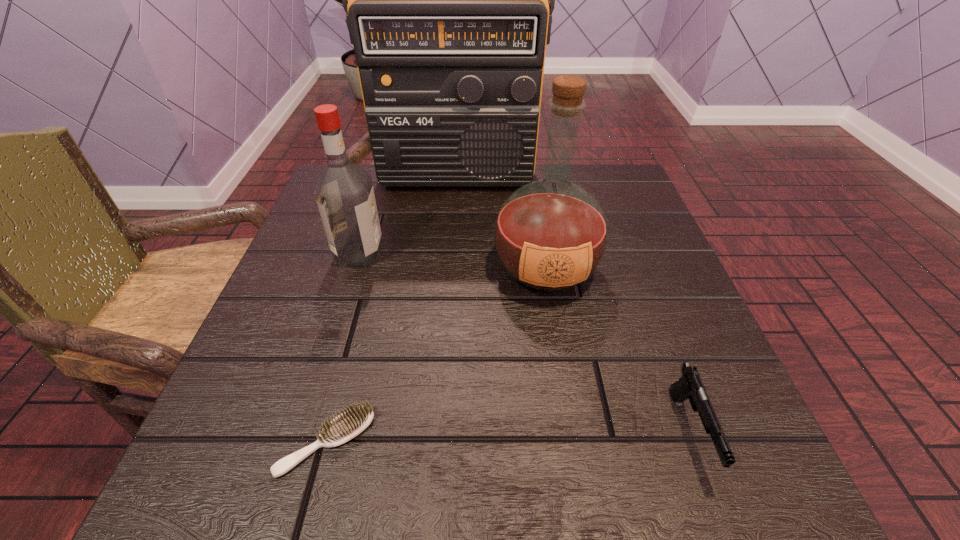
Find the location of a particular element. The image size is (960, 540). the farthest object is located at coordinates (446, 0).

At what (x,y) coordinates should I click in order to perform the action: click on the taller liquor. Please return your answer as a coordinate pair (x, y). Image resolution: width=960 pixels, height=540 pixels. Looking at the image, I should click on (550, 235).

I want to click on the right liquor, so click(x=550, y=235).

This screenshot has width=960, height=540. What are the coordinates of `the third shortest object` in the screenshot? It's located at (344, 193).

The height and width of the screenshot is (540, 960). I want to click on the left liquor, so click(x=344, y=193).

Identify the location of the second shortest object. (690, 386).

Where is `gun`? Image resolution: width=960 pixels, height=540 pixels. gun is located at coordinates (690, 386).

Identify the location of scrubbing brush. Image resolution: width=960 pixels, height=540 pixels. (349, 424).

Find the location of a particular element. The image size is (960, 540). free space located on the front-facing side of the radio receiver is located at coordinates coord(450,252).

In order to click on vacant space positioned on the front label of the fourth shortest object in this screenshot , I will do `click(583, 502)`.